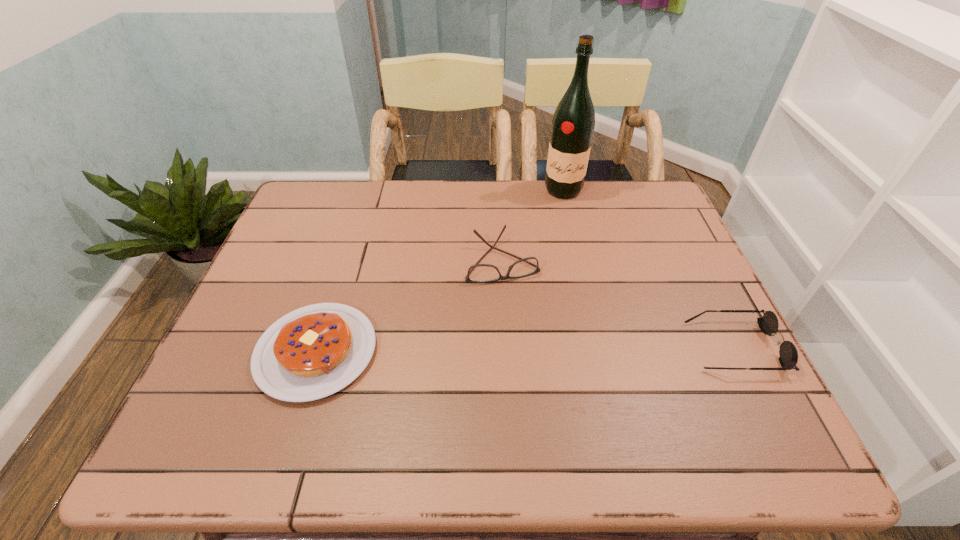
This screenshot has height=540, width=960. I want to click on vacant area that satisfies the following two spatial constraints: 1. on the back side of the leftmost object; 2. on the left side of the third object from left to right, so click(x=368, y=190).

The image size is (960, 540). Identify the location of free spot that satisfies the following two spatial constraints: 1. on the back side of the second object from left to right; 2. on the right side of the pancake. (346, 259).